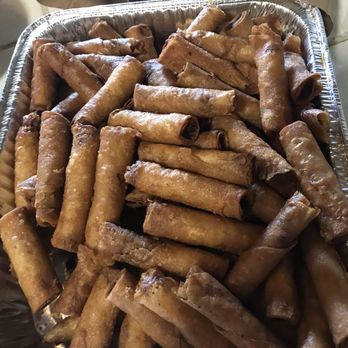
Identify the location of right metal pan. This screenshot has width=348, height=348. (306, 27).